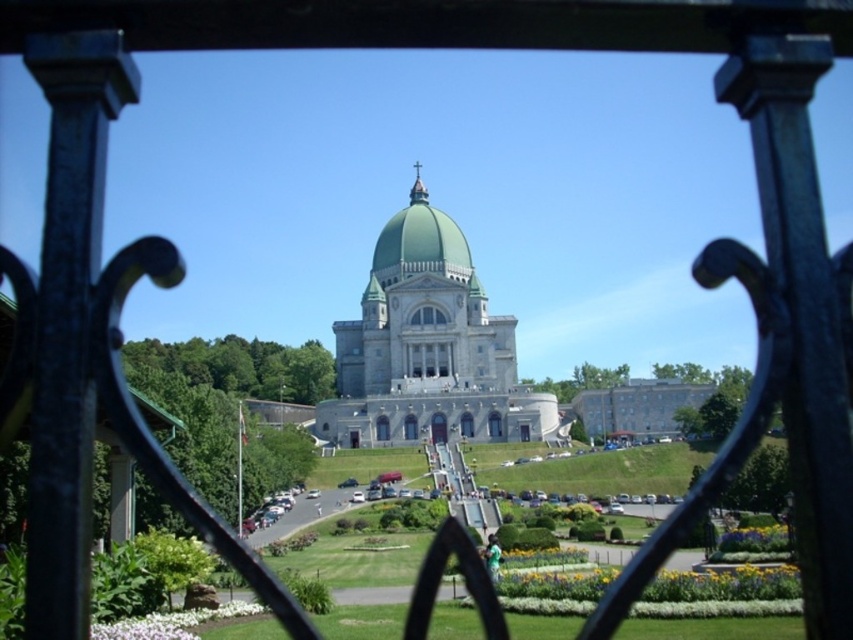
Between green marble palace at center and green matte dome at center, which one has more height?

With more height is green marble palace at center.

Locate an element on the screen. The image size is (853, 640). green marble palace at center is located at coordinates (428, 348).